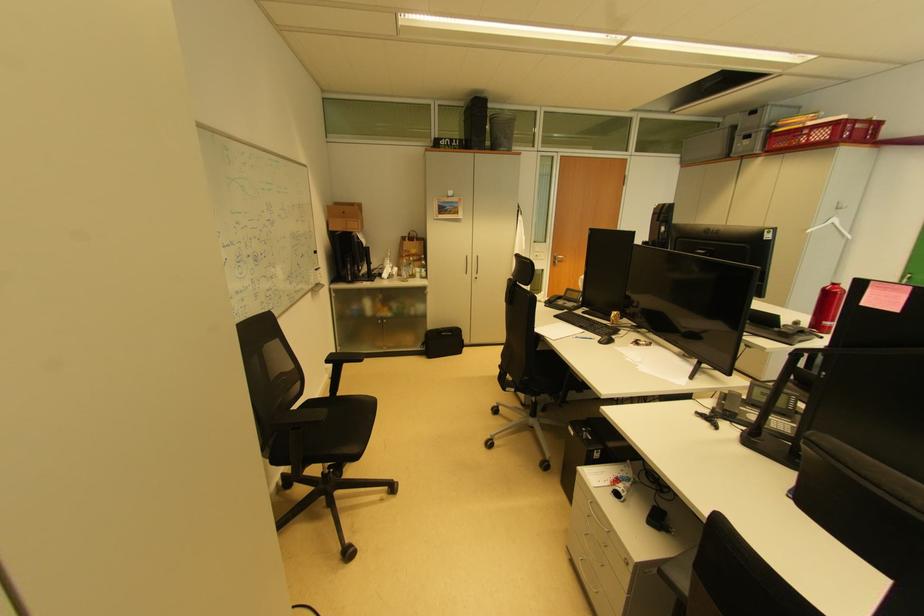
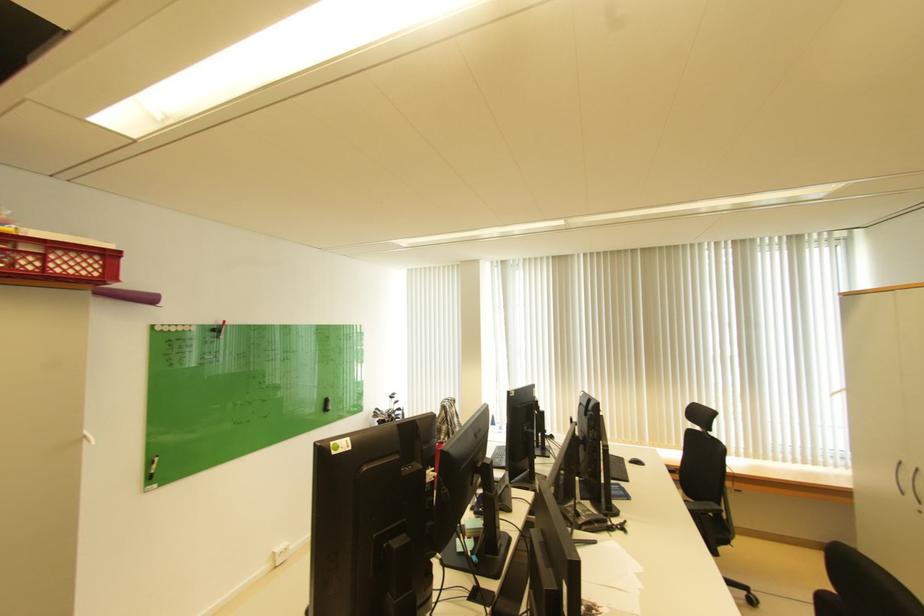
The point at (817, 140) is marked in the first image. Where is the corresponding point in the second image?

(54, 268)